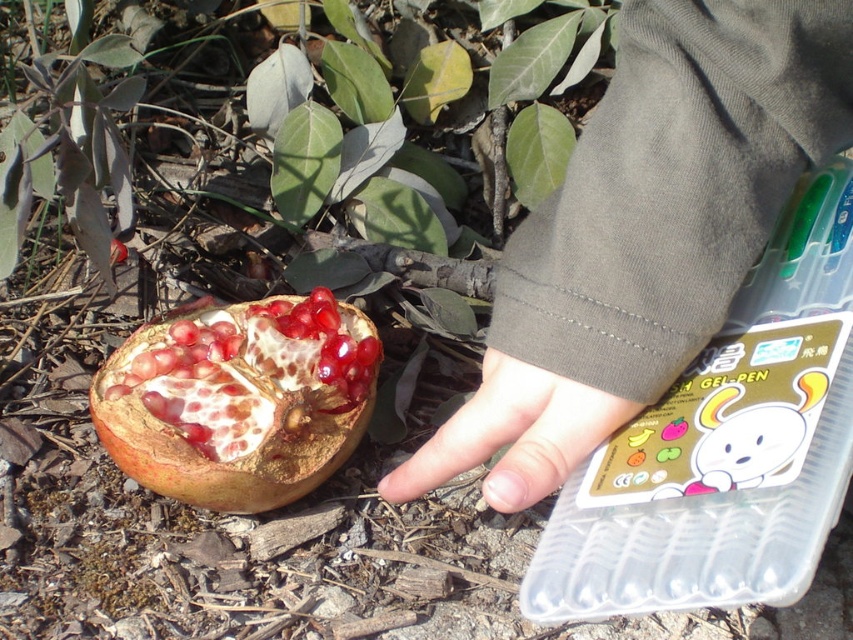
You are holding a 10 cm ruler and want to measure the distance between the pomegranate and the transparent plastic container. The pomegranate is at point (263, 384). Can you reach the pomegranate with the ruler without moving your hand?

The distance between the point (263, 384) and the viewer is 79.98 centimeters. Since the ruler is only 10 cm long, you cannot reach the pomegranate at point (263, 384) with the ruler without moving your hand.

You are an artist trying to sketch this scene. You need to place the dark gray fabric at upper right and the shiny red pomegranate at lower left in your drawing. Based on the scene description, which object is positioned higher in the image?

The dark gray fabric at upper right is positioned higher in the image than the shiny red pomegranate at lower left.

Looking at this image, you are holding a small toy that is 10 inches long and want to place it on the ground near the shiny red pomegranate at lower left without touching it. What is the minimum distance you should keep between the toy and the pomegranate?

The minimum distance you should keep between the toy and the shiny red pomegranate at lower left is 19.3 inches, since the total distance between you and the pomegranate is 29.3 inches and the toy is 10 inches long, so subtracting the toy length from the total distance gives 29.3 minus 10 equals 19.3 inches.